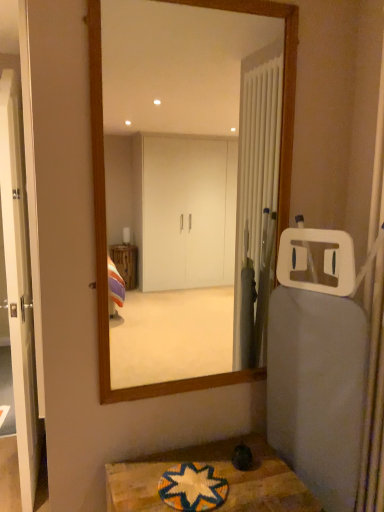
Question: Are multicolored woven mat at lower center and wooden framed mirror at center making contact?

Choices:
 (A) yes
 (B) no

Answer: (B)

Question: Considering the relative sizes of multicolored woven mat at lower center and wooden framed mirror at center in the image provided, is multicolored woven mat at lower center wider than wooden framed mirror at center?

Choices:
 (A) yes
 (B) no

Answer: (A)

Question: Is multicolored woven mat at lower center not inside wooden framed mirror at center?

Choices:
 (A) yes
 (B) no

Answer: (A)

Question: Would you say multicolored woven mat at lower center contains wooden framed mirror at center?

Choices:
 (A) yes
 (B) no

Answer: (B)

Question: Is multicolored woven mat at lower center closer to camera compared to wooden framed mirror at center?

Choices:
 (A) no
 (B) yes

Answer: (B)

Question: Can you confirm if multicolored woven mat at lower center is taller than wooden framed mirror at center?

Choices:
 (A) yes
 (B) no

Answer: (B)

Question: From the image's perspective, is white glossy door at left located beneath wooden textured table at lower center?

Choices:
 (A) yes
 (B) no

Answer: (B)

Question: Is white glossy door at left in contact with wooden textured table at lower center?

Choices:
 (A) yes
 (B) no

Answer: (B)

Question: Could you tell me if white glossy door at left is facing wooden textured table at lower center?

Choices:
 (A) yes
 (B) no

Answer: (B)

Question: Is white glossy door at left at the right side of wooden textured table at lower center?

Choices:
 (A) no
 (B) yes

Answer: (A)

Question: Is white glossy door at left wider than wooden textured table at lower center?

Choices:
 (A) yes
 (B) no

Answer: (B)

Question: Is the position of white glossy door at left more distant than that of wooden textured table at lower center?

Choices:
 (A) yes
 (B) no

Answer: (A)

Question: From a real-world perspective, is wooden framed mirror at center beneath white glossy door at left?

Choices:
 (A) no
 (B) yes

Answer: (A)